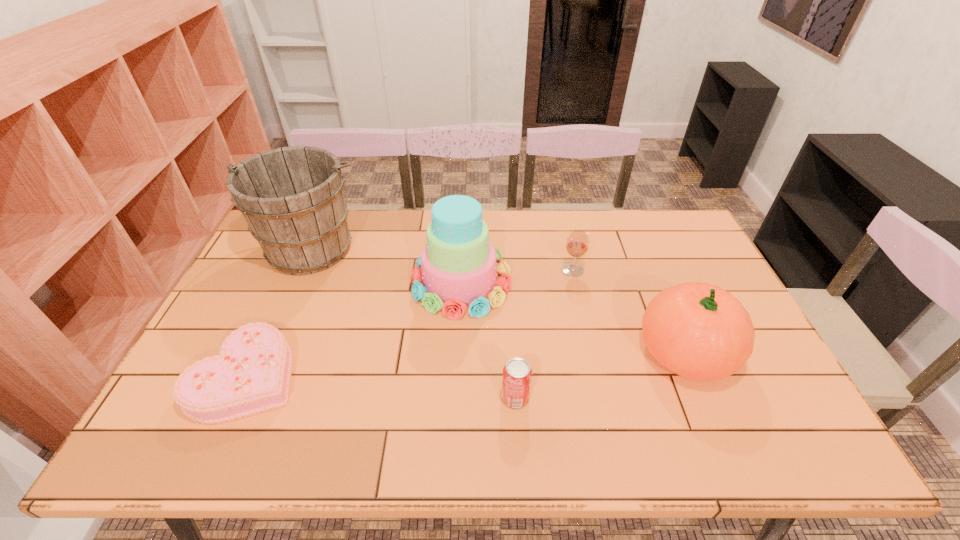
Where is `object at the far left corner`? The width and height of the screenshot is (960, 540). object at the far left corner is located at coordinates (292, 198).

Find the location of a particular element. Image resolution: width=960 pixels, height=540 pixels. object positioned at the near left corner is located at coordinates (251, 374).

In order to click on vacant space at the far edge in this screenshot , I will do `click(618, 241)`.

Locate an element on the screen. The width and height of the screenshot is (960, 540). vacant space at the near edge of the desktop is located at coordinates (728, 429).

This screenshot has height=540, width=960. In order to click on vacant position at the left edge of the desktop in this screenshot , I will do `click(215, 328)`.

Identify the location of vacant point at the right edge. (695, 278).

At what (x,y) coordinates should I click in order to perform the action: click on free spot at the near left corner of the desktop. Please return your answer as a coordinate pair (x, y). Image resolution: width=960 pixels, height=540 pixels. Looking at the image, I should click on (153, 437).

Find the location of a particular element. The height and width of the screenshot is (540, 960). blank area at the near right corner is located at coordinates (758, 435).

Where is `free space between the second object from right to left and the shorter cake`? The height and width of the screenshot is (540, 960). free space between the second object from right to left and the shorter cake is located at coordinates (410, 323).

Image resolution: width=960 pixels, height=540 pixels. I want to click on vacant point located between the shorter cake and the second object from right to left, so click(x=410, y=323).